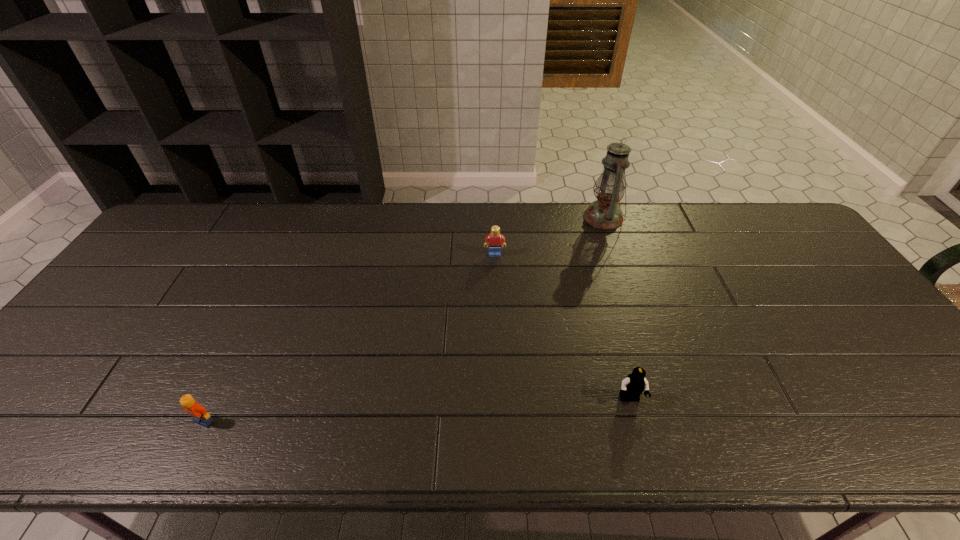
You are a GUI agent. You are given a task and a screenshot of the screen. Output one action in this format:
    pyautogui.click(x=<x>, y=<y>)
    Task: Click on the unoccupied position between the second nearest object and the tallest object
    The height and width of the screenshot is (540, 960).
    Given the screenshot: What is the action you would take?
    pyautogui.click(x=616, y=308)

I want to click on vacant space that is in between the second nearest Lego and the nearest Lego, so click(x=417, y=410).

Locate an element on the screen. The height and width of the screenshot is (540, 960). free space between the oil lamp and the third farthest object is located at coordinates (616, 308).

Identify the location of empty location between the farthest Lego and the leftmost Lego. This screenshot has width=960, height=540. (349, 338).

Identify the location of vacant area that lies between the second farthest object and the rightmost Lego. The width and height of the screenshot is (960, 540). (563, 327).

Image resolution: width=960 pixels, height=540 pixels. Find the location of `free spot between the tallest object and the rightmost Lego`. free spot between the tallest object and the rightmost Lego is located at coordinates (616, 308).

Find the location of a particular element. The image size is (960, 540). vacant area between the farthest object and the rightmost Lego is located at coordinates (616, 308).

Identify the location of free point between the third nearest object and the leftmost object. The image size is (960, 540). (349, 338).

At what (x,y) coordinates should I click in order to perform the action: click on the third closest object relative to the third nearest object. Please return your answer as a coordinate pair (x, y). Looking at the image, I should click on (194, 409).

Locate an element on the screen. The height and width of the screenshot is (540, 960). object that is the third closest to the oil lamp is located at coordinates (194, 409).